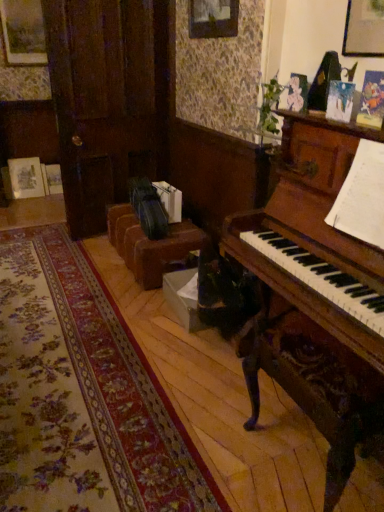
Question: Is wooden picture frame at upper right a part of brown leather couch at center?

Choices:
 (A) no
 (B) yes

Answer: (A)

Question: Does brown leather couch at center have a greater width compared to wooden picture frame at upper right?

Choices:
 (A) yes
 (B) no

Answer: (A)

Question: Is brown leather couch at center further to the viewer compared to wooden picture frame at upper right?

Choices:
 (A) yes
 (B) no

Answer: (A)

Question: Is brown leather couch at center to the right of wooden picture frame at upper right from the viewer's perspective?

Choices:
 (A) no
 (B) yes

Answer: (A)

Question: Would you say brown leather couch at center is outside wooden picture frame at upper right?

Choices:
 (A) yes
 (B) no

Answer: (A)

Question: Is brown leather couch at center turned away from wooden picture frame at upper right?

Choices:
 (A) yes
 (B) no

Answer: (B)

Question: Can you confirm if wooden picture frame at upper right is thinner than brown leather couch at center?

Choices:
 (A) no
 (B) yes

Answer: (B)

Question: From the image's perspective, is wooden picture frame at upper right located beneath brown leather couch at center?

Choices:
 (A) yes
 (B) no

Answer: (B)

Question: Is the position of wooden picture frame at upper right more distant than that of brown leather couch at center?

Choices:
 (A) no
 (B) yes

Answer: (A)

Question: Is brown leather couch at center at the back of wooden picture frame at upper right?

Choices:
 (A) yes
 (B) no

Answer: (B)

Question: Is wooden picture frame at upper right facing towards brown leather couch at center?

Choices:
 (A) yes
 (B) no

Answer: (B)

Question: Does wooden picture frame at upper right come in front of brown leather couch at center?

Choices:
 (A) no
 (B) yes

Answer: (B)

Question: In the image, is brown leather couch at center positioned in front of or behind wooden picture frame at upper right?

Choices:
 (A) front
 (B) behind

Answer: (B)